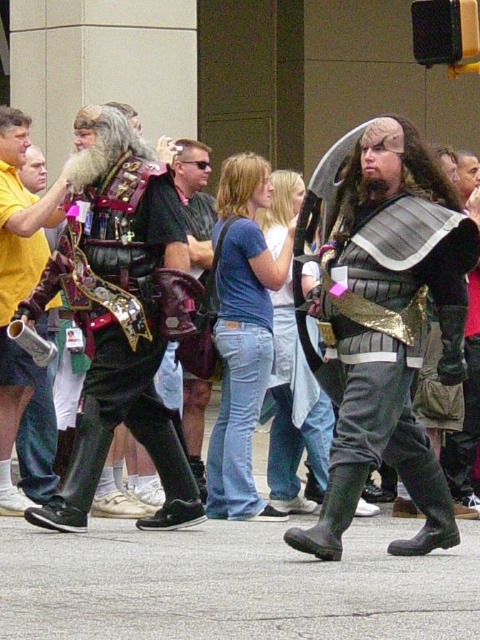
Question: Can you confirm if shiny black armor at center is positioned above brushed metal helmet at left?

Choices:
 (A) no
 (B) yes

Answer: (A)

Question: Which point is farther to the camera?

Choices:
 (A) shiny black armor at center
 (B) brushed metal helmet at left
 (C) shiny metallic armor at left

Answer: (B)

Question: Which of the following is the closest to the observer?

Choices:
 (A) (453, 294)
 (B) (84, 186)
 (C) (3, 180)

Answer: (A)

Question: Is shiny black armor at center positioned before shiny metallic armor at left?

Choices:
 (A) yes
 (B) no

Answer: (A)

Question: Which point appears farthest from the camera in this image?

Choices:
 (A) (358, 435)
 (B) (124, 232)
 (C) (24, 150)

Answer: (C)

Question: Is shiny black armor at center to the right of brushed metal helmet at left from the viewer's perspective?

Choices:
 (A) no
 (B) yes

Answer: (B)